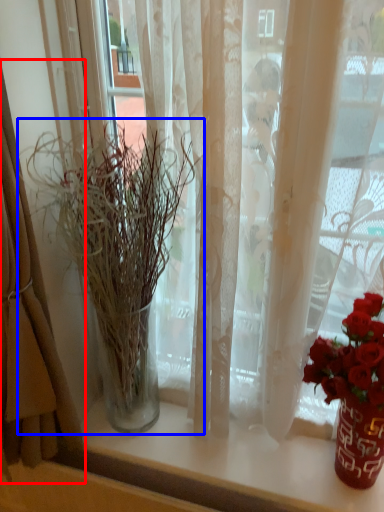
Question: Which object appears closest to the camera in this image, curtain (highlighted by a red box) or houseplant (highlighted by a blue box)?

Choices:
 (A) curtain
 (B) houseplant

Answer: (A)